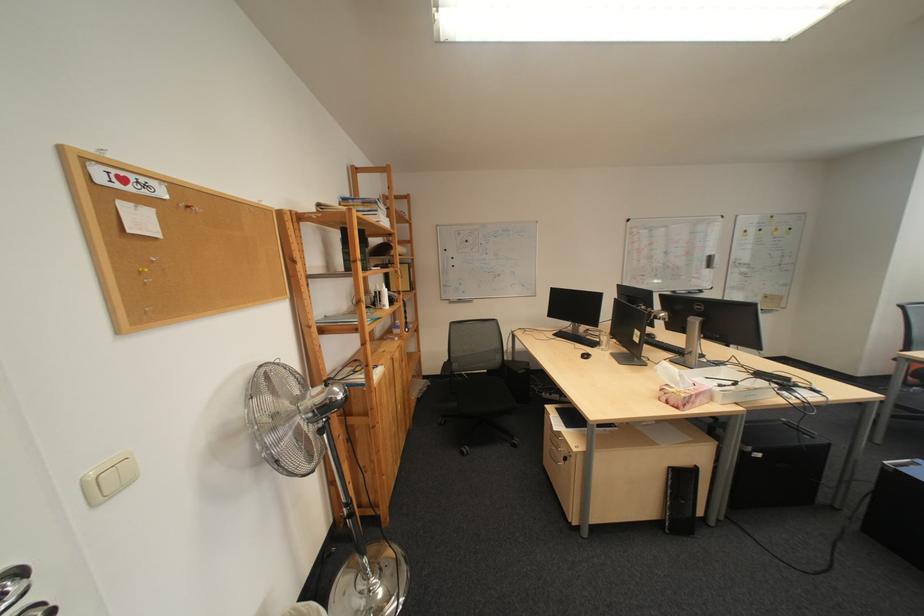
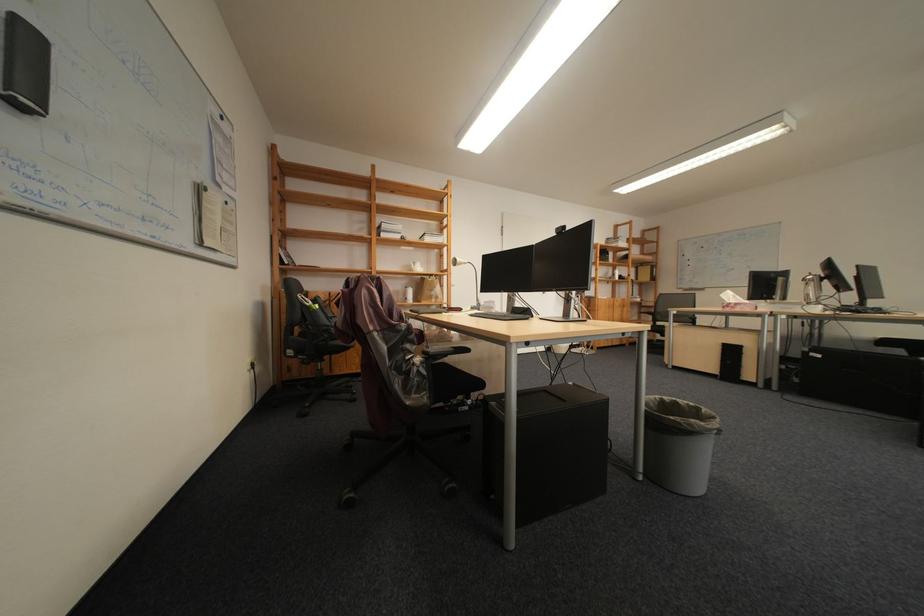
In the second image, find the point that corresponds to [708,405] in the first image.

(747, 309)